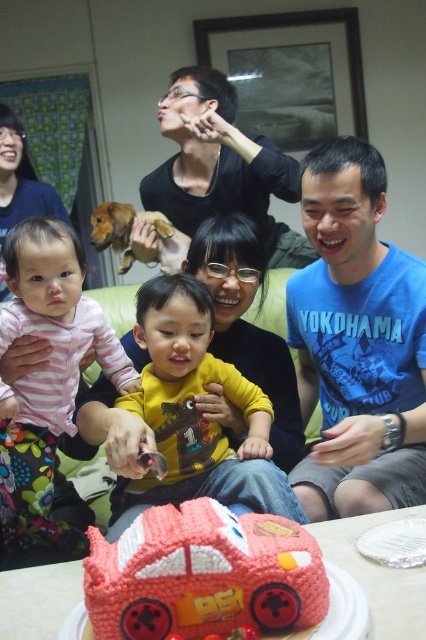
Measure the distance from blue cotton shirt at center to smooth red car at center.

The distance of blue cotton shirt at center from smooth red car at center is 22.59 inches.

Is blue cotton shirt at center positioned at the back of smooth red car at center?

Yes, blue cotton shirt at center is further from the viewer.

The height and width of the screenshot is (640, 426). In order to click on blue cotton shirt at center in this screenshot , I will do `click(356, 340)`.

Between yellow matte shirt at center and black matte shirt at upper center, which one has more height?

black matte shirt at upper center is taller.

Locate an element on the screen. This screenshot has height=640, width=426. yellow matte shirt at center is located at coordinates (193, 412).

Is blue cotton shirt at center positioned before striped fabric baby at left?

Yes, it is in front of striped fabric baby at left.

Between blue cotton shirt at center and striped fabric baby at left, which one is positioned higher?

Positioned higher is blue cotton shirt at center.

Does point (347, 250) come closer to viewer compared to point (2, 342)?

No.

At what (x,y) coordinates should I click in order to perform the action: click on blue cotton shirt at center. Please return your answer as a coordinate pair (x, y). Looking at the image, I should click on (356, 340).